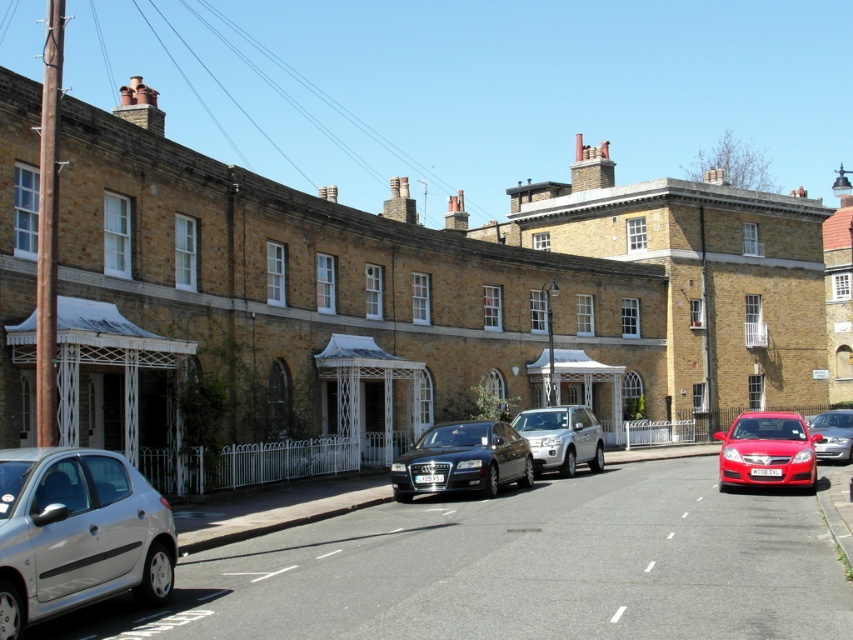
You are standing on the street looking at the row of terraced houses. There are two points marked on the image. The first point is at coordinates point (434,484) and the second point is at point (553,456). Which point appears closer to you?

Point (434,484) is closer to the camera than point (553,456).

You are a delivery person who needs to park your van between the silver metallic hatchback at lower left and the shiny black sedan at center. Is there enough space between them to fit your van that is 5 meters long?

The silver metallic hatchback at lower left is to the left of shiny black sedan at center, but the distance between them is not specified. Without knowing the exact spacing, it is impossible to determine if the van will fit.

You are a delivery person trying to park a van that is 5 meters long. You see the shiny black sedan at center and the silver metallic suv at center parked on the street. Which vehicle should you avoid parking next to to ensure your van has enough space?

The shiny black sedan at center is bigger than the silver metallic suv at center, so you should avoid parking next to the shiny black sedan at center to ensure your van has enough space.